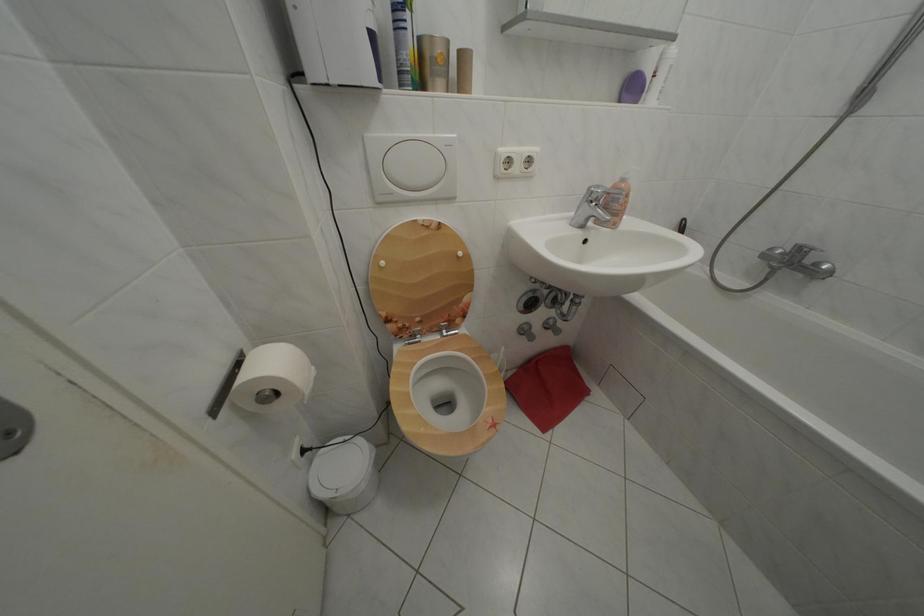
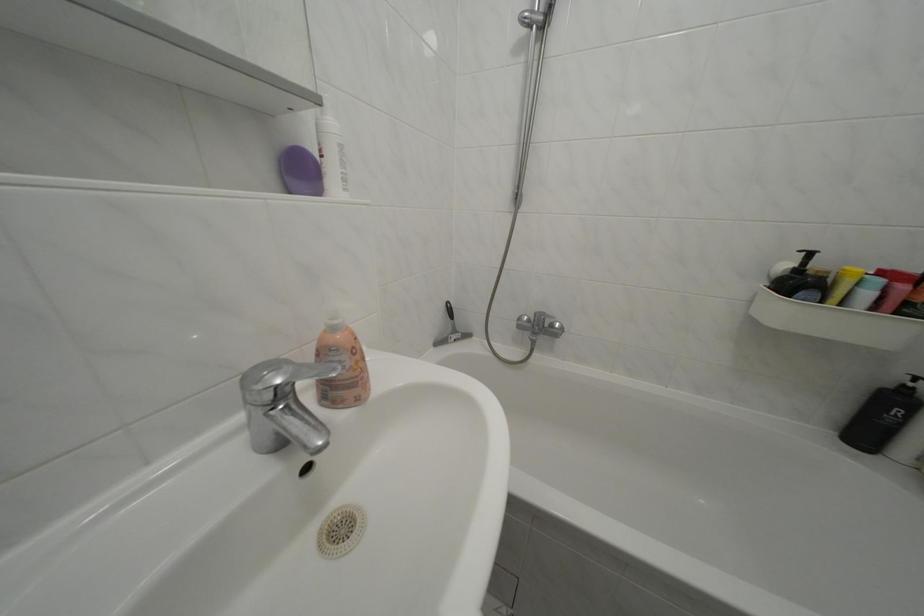
Find the pixel in the second image that matches (631,187) in the first image.

(342, 334)